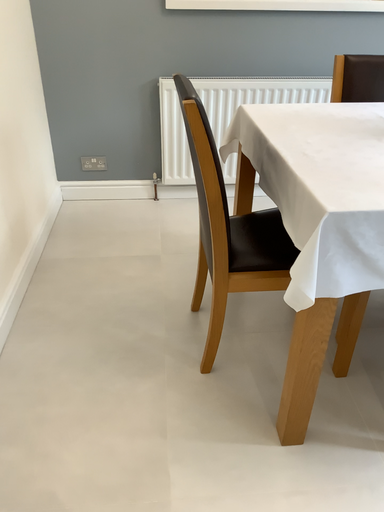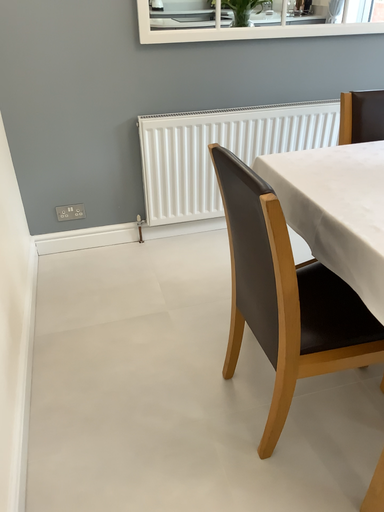
Question: Which way did the camera rotate in the video?

Choices:
 (A) rotated right
 (B) rotated left

Answer: (A)